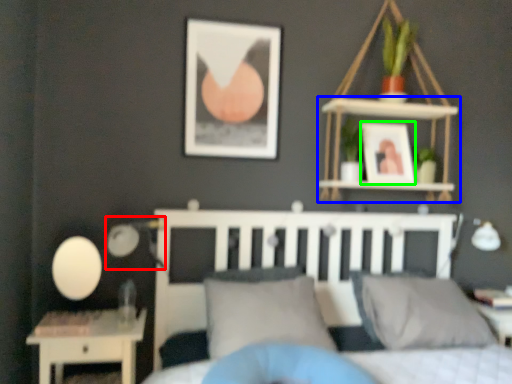
Question: Based on their relative distances, which object is nearer to table lamp (highlighted by a red box)? Choose from shelf (highlighted by a blue box) and picture frame (highlighted by a green box).

Choices:
 (A) shelf
 (B) picture frame

Answer: (A)